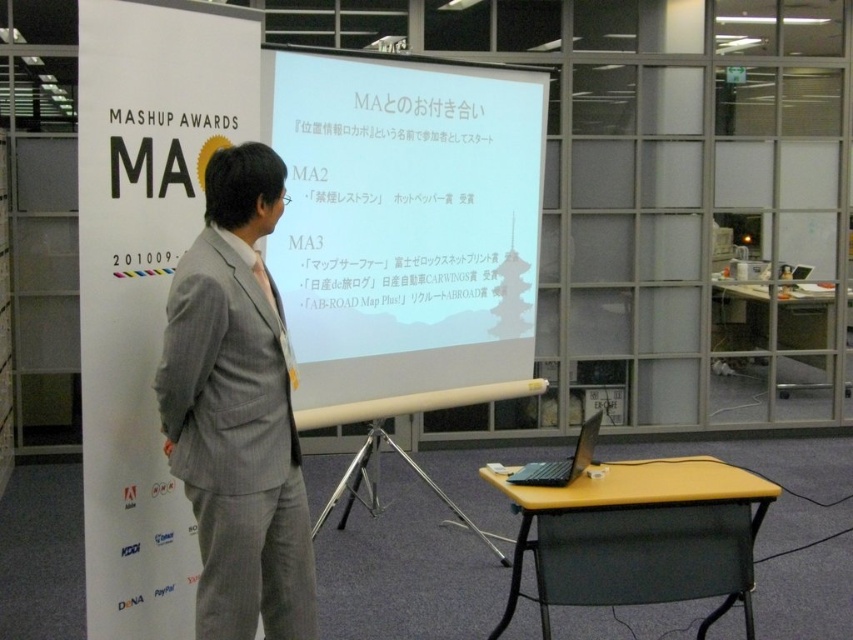
You are an attendee at the presentation and want to take a photo of the white matte projector screen at center and the gray textured suit at center. Which object should you focus on first if you want to capture both in a single frame without moving the camera?

The white matte projector screen at center is wider than the gray textured suit at center. Since the screen is wider, you should focus on centering the screen first to ensure it fits within the frame, then adjust to include the suit.

You are an attendee at the presentation and need to take a photo of the white matte projector screen at center and the black matte laptop at lower right. Which object should you position closer to the camera to ensure both are fully visible in the frame?

The white matte projector screen at center is taller than the black matte laptop at lower right, so you should position the camera closer to the black matte laptop at lower right to ensure both objects fit within the frame.